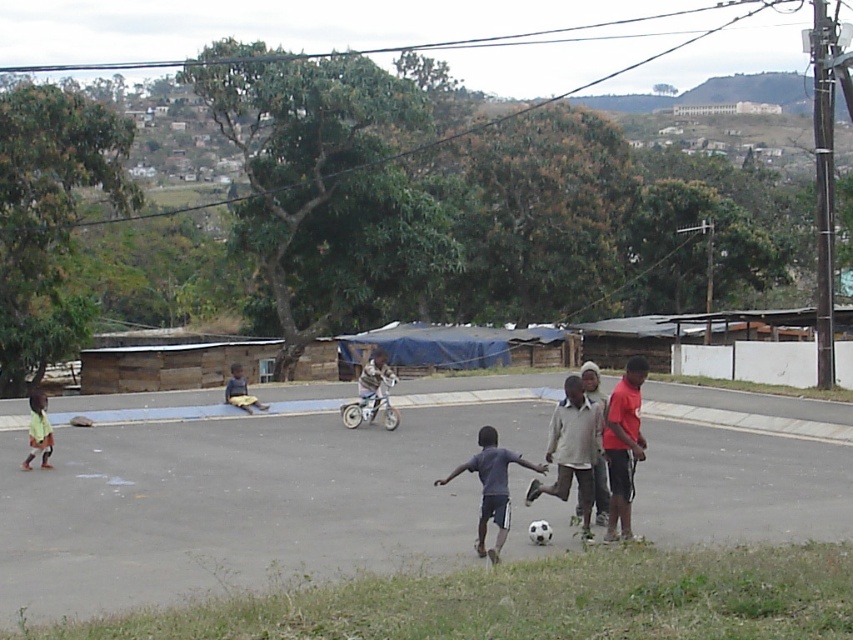
Question: Which of the following is the closest to the observer?

Choices:
 (A) light green shirt at lower left
 (B) light gray cotton shirt at center
 (C) dark blue jersey at center
 (D) light brown wooden bench at center

Answer: (C)

Question: Can you confirm if red cotton shirt at right is positioned above light green shirt at lower left?

Choices:
 (A) yes
 (B) no

Answer: (A)

Question: Based on their relative distances, which object is farther from the red cotton shirt at right?

Choices:
 (A) dark blue jersey at center
 (B) light gray cotton shirt at center

Answer: (A)

Question: Is light gray cotton shirt at center above light brown wooden bench at center?

Choices:
 (A) yes
 (B) no

Answer: (B)

Question: From the image, what is the correct spatial relationship of light green shirt at lower left in relation to light brown wooden bench at center?

Choices:
 (A) below
 (B) above

Answer: (A)

Question: Estimate the real-world distances between objects in this image. Which object is closer to the light green shirt at lower left?

Choices:
 (A) light gray cotton shirt at center
 (B) dark blue jersey at center

Answer: (B)